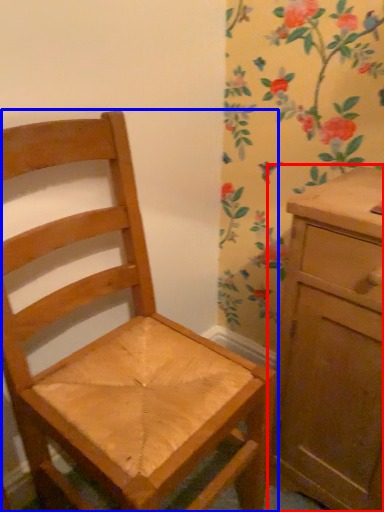
Question: Which object is closer to the camera taking this photo, chest of drawers (highlighted by a red box) or chair (highlighted by a blue box)?

Choices:
 (A) chest of drawers
 (B) chair

Answer: (B)